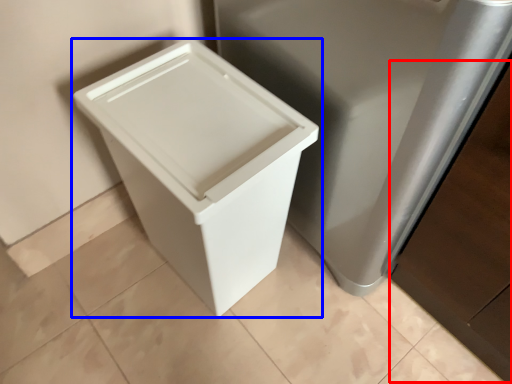
Question: Which object appears closest to the camera in this image, cabinetry (highlighted by a red box) or waste container (highlighted by a blue box)?

Choices:
 (A) cabinetry
 (B) waste container

Answer: (A)